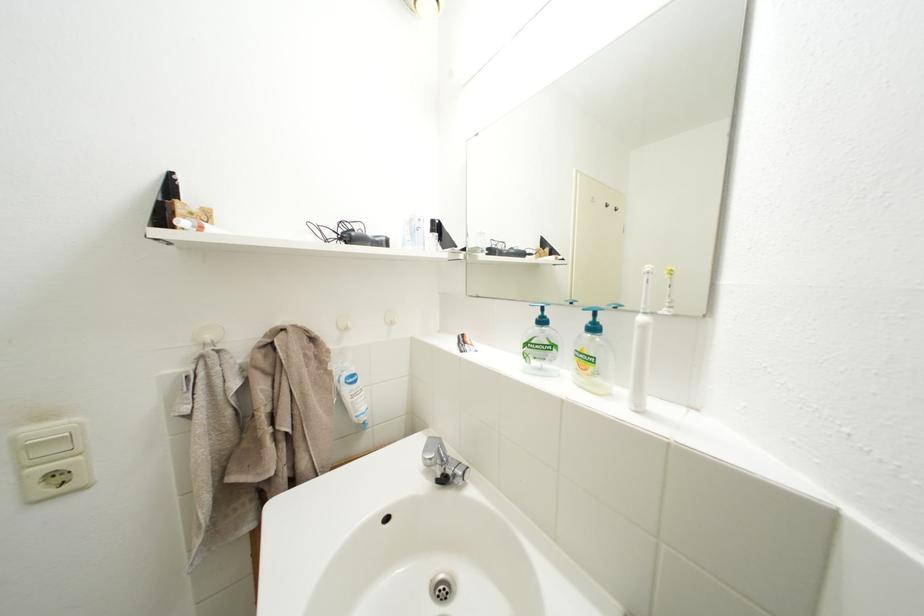
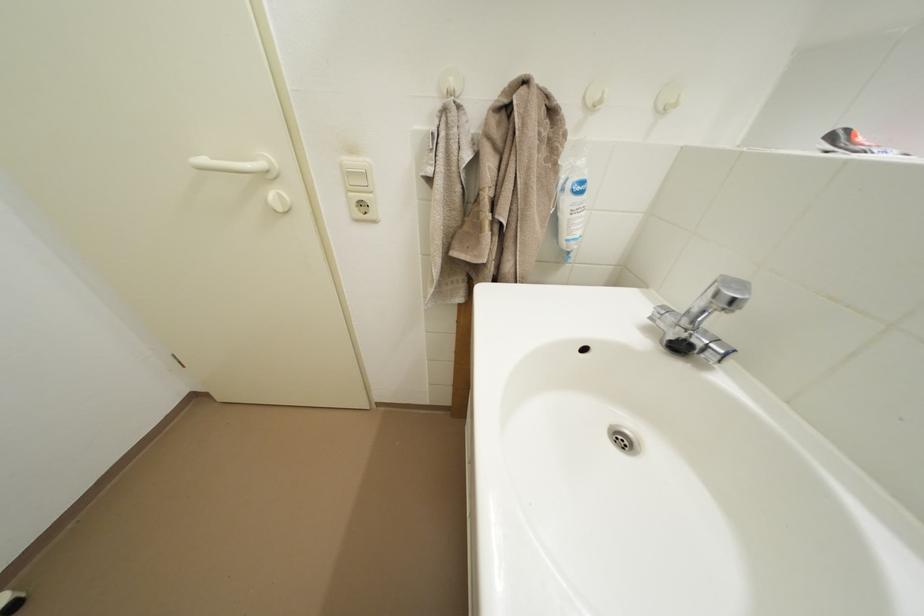
Looking at this image, how did the camera likely rotate?

The camera rotated toward left-down.